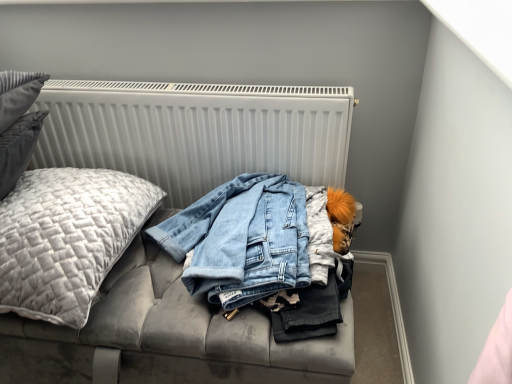
Question: From the image's perspective, is quilted gray pillow at left located above white ribbed radiator at upper center?

Choices:
 (A) no
 (B) yes

Answer: (A)

Question: Is quilted gray pillow at left bigger than white ribbed radiator at upper center?

Choices:
 (A) yes
 (B) no

Answer: (A)

Question: Does quilted gray pillow at left have a lesser width compared to white ribbed radiator at upper center?

Choices:
 (A) no
 (B) yes

Answer: (A)

Question: Can you confirm if quilted gray pillow at left is positioned to the right of white ribbed radiator at upper center?

Choices:
 (A) yes
 (B) no

Answer: (B)

Question: Does quilted gray pillow at left lie behind white ribbed radiator at upper center?

Choices:
 (A) yes
 (B) no

Answer: (B)

Question: In the image, is velvet grey couch at center on the left side or the right side of quilted gray pillow at left?

Choices:
 (A) right
 (B) left

Answer: (A)

Question: Is velvet grey couch at center bigger or smaller than quilted gray pillow at left?

Choices:
 (A) small
 (B) big

Answer: (B)

Question: From the image's perspective, is velvet grey couch at center above or below quilted gray pillow at left?

Choices:
 (A) below
 (B) above

Answer: (A)

Question: Is velvet grey couch at center situated inside quilted gray pillow at left or outside?

Choices:
 (A) inside
 (B) outside

Answer: (B)

Question: Is white ribbed radiator at upper center bigger or smaller than quilted gray pillow at left?

Choices:
 (A) small
 (B) big

Answer: (A)

Question: From the image's perspective, is white ribbed radiator at upper center located above or below quilted gray pillow at left?

Choices:
 (A) above
 (B) below

Answer: (A)

Question: In terms of height, does white ribbed radiator at upper center look taller or shorter compared to quilted gray pillow at left?

Choices:
 (A) tall
 (B) short

Answer: (A)

Question: Would you say white ribbed radiator at upper center is to the left or to the right of quilted gray pillow at left in the picture?

Choices:
 (A) right
 (B) left

Answer: (A)

Question: Is quilted gray pillow at left inside or outside of white ribbed radiator at upper center?

Choices:
 (A) outside
 (B) inside

Answer: (A)

Question: Relative to white ribbed radiator at upper center, is quilted gray pillow at left in front or behind?

Choices:
 (A) front
 (B) behind

Answer: (A)